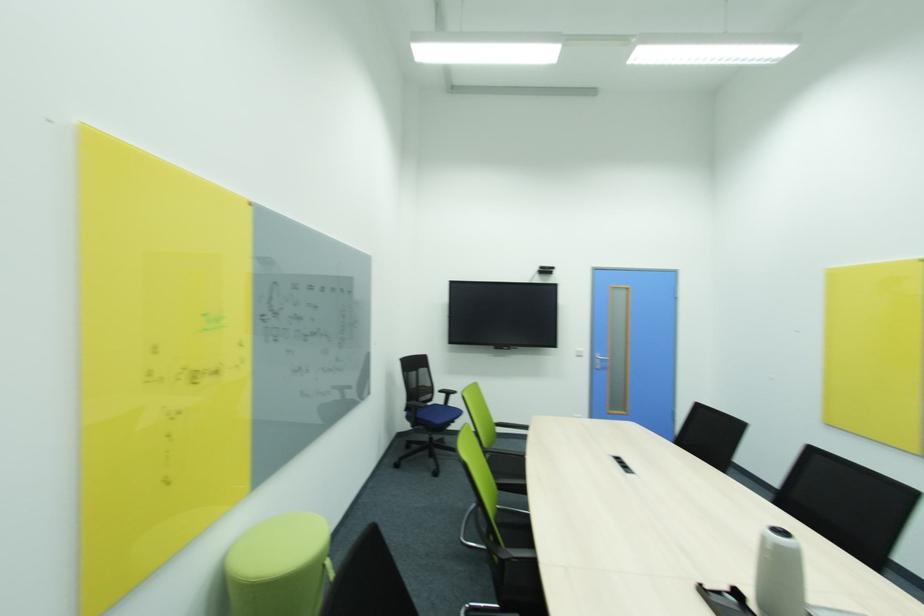
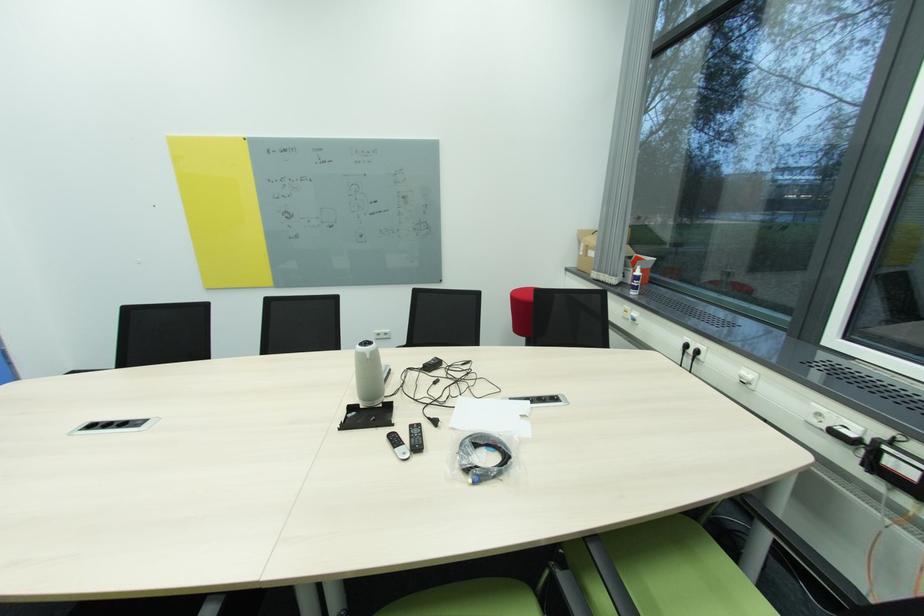
The point at (x=774, y=548) is marked in the first image. Where is the corresponding point in the second image?

(372, 358)